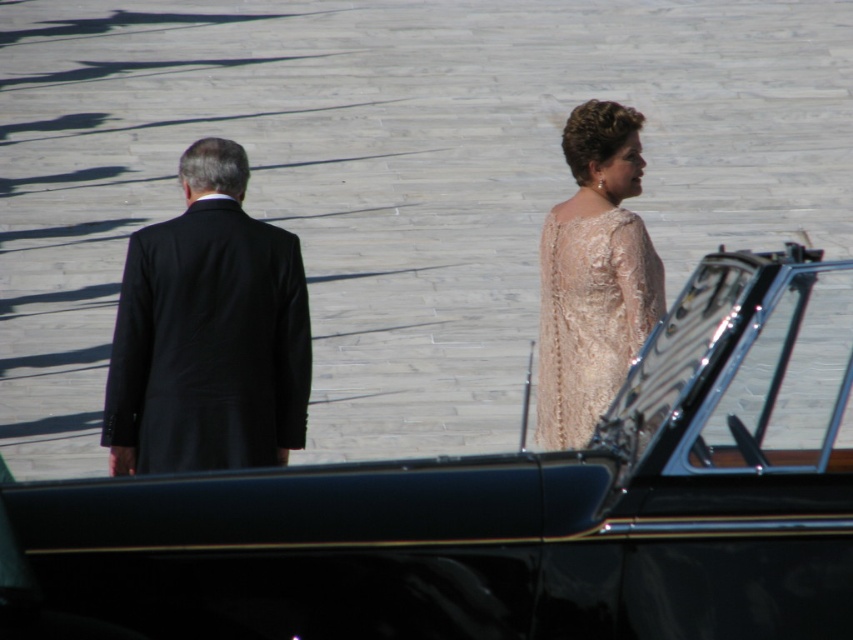
Question: Estimate the real-world distances between objects in this image. Which object is farther from the black glossy car at center?

Choices:
 (A) black smooth suit at left
 (B) ivory lace dress at right
 (C) matte black suit at left

Answer: (C)

Question: Can you confirm if black glossy car at center is bigger than black smooth suit at left?

Choices:
 (A) yes
 (B) no

Answer: (A)

Question: Which is farther from the black smooth suit at left?

Choices:
 (A) ivory lace dress at right
 (B) matte black suit at left
 (C) black glossy car at center

Answer: (C)

Question: Which point is closer to the camera taking this photo?

Choices:
 (A) (675, 317)
 (B) (614, 304)
 (C) (547, 419)
 (D) (210, 316)

Answer: (A)

Question: Can you confirm if black glossy car at center is positioned to the left of black smooth suit at left?

Choices:
 (A) yes
 (B) no

Answer: (B)

Question: Can you confirm if black smooth suit at left is positioned below ivory lace dress at right?

Choices:
 (A) yes
 (B) no

Answer: (B)